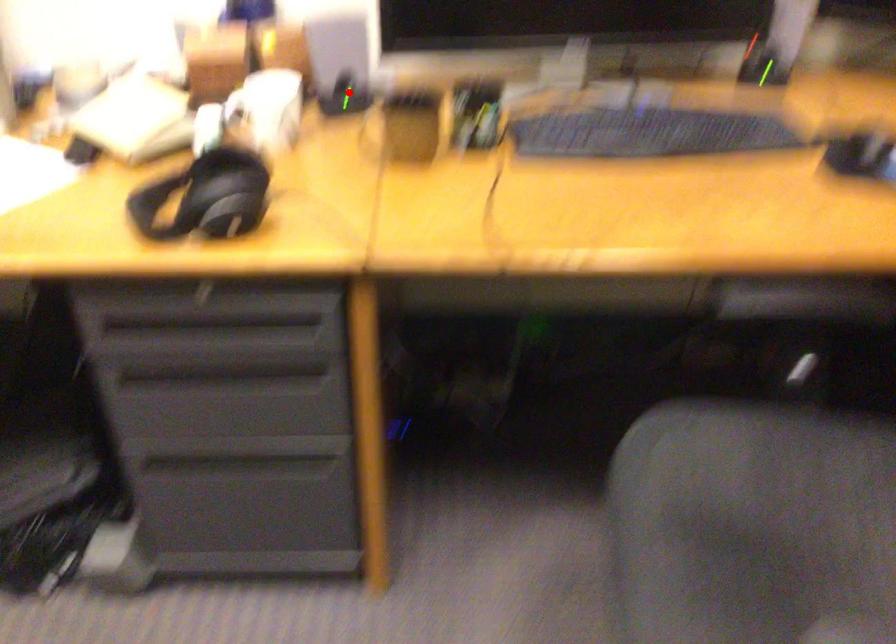
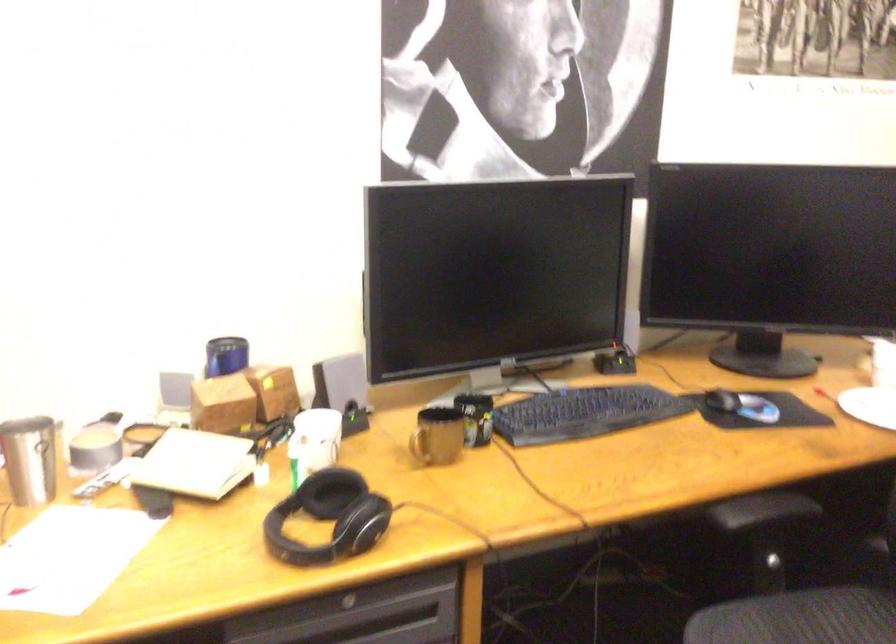
Question: A red point is marked in image1. In image2, is the corresponding 3D point closer to the camera or farther? Reply with the corresponding letter.

Choices:
 (A) The corresponding 3D point is closer.
 (B) The corresponding 3D point is farther.

Answer: (B)